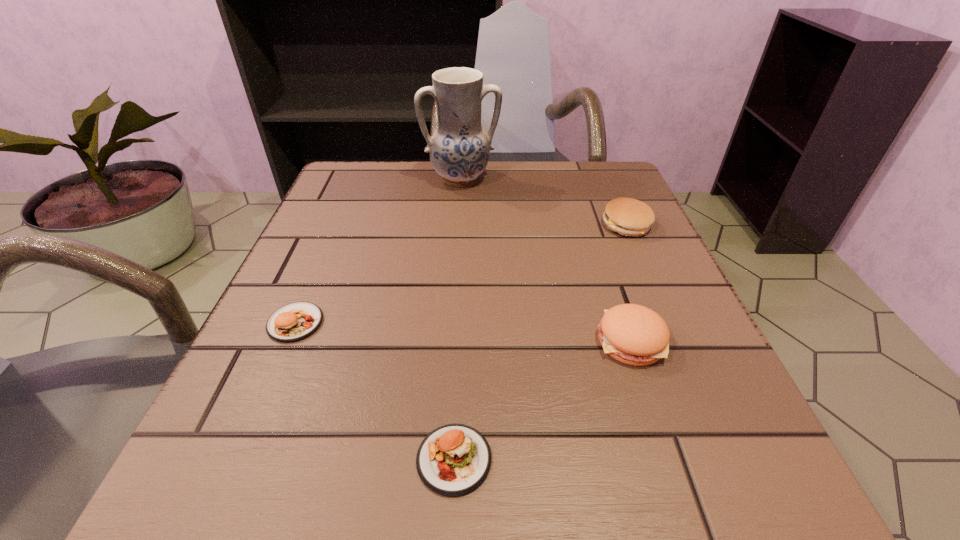
The image size is (960, 540). In order to click on vacant space at the far right corner of the desktop in this screenshot , I will do `click(571, 184)`.

The width and height of the screenshot is (960, 540). In the image, there is a desktop. Find the location of `free region at the near right corner`. free region at the near right corner is located at coordinates 714,481.

Find the location of a particular element. Image resolution: width=960 pixels, height=540 pixels. free space between the nearest object and the second farthest object is located at coordinates (540, 342).

The height and width of the screenshot is (540, 960). I want to click on vacant point located between the tallest object and the leftmost object, so click(378, 251).

Where is `empty location between the leftmost patty (food) and the nearest object`? The image size is (960, 540). empty location between the leftmost patty (food) and the nearest object is located at coordinates (374, 391).

You are a GUI agent. You are given a task and a screenshot of the screen. Output one action in this format:
    pyautogui.click(x=<x>, y=<y>)
    Task: Click on the vacant space that's between the leftmost object and the second farthest object
    This screenshot has height=540, width=960.
    Given the screenshot: What is the action you would take?
    pyautogui.click(x=461, y=274)

This screenshot has height=540, width=960. In order to click on free area in between the tallest object and the leftmost object in this screenshot , I will do [x=378, y=251].

The image size is (960, 540). Identify the location of unoccupied position between the second patty (food) from left to right and the pottery. (458, 319).

In order to click on blank region between the fourth nearest object and the leftmost object in this screenshot , I will do [461, 274].

I want to click on object identified as the closest to the nearest patty (food), so click(x=632, y=334).